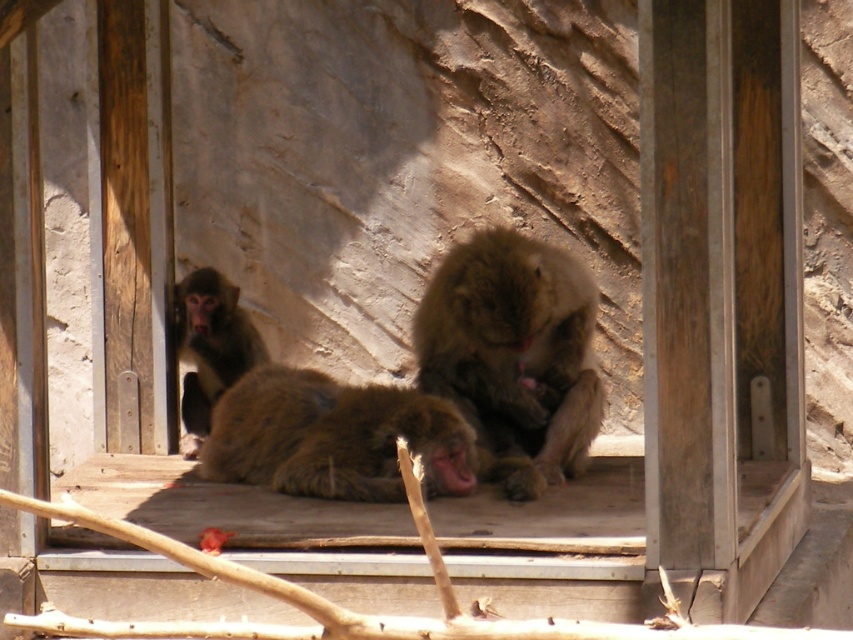
Does brown furry monkey at center have a lesser height compared to brown fur monkey at left?

No.

Between brown furry monkey at center and brown fur monkey at left, which one has less height?

brown fur monkey at left

Is point (534, 400) in front of point (210, 282)?

Yes, it is.

Where is `brown furry monkey at center`? Image resolution: width=853 pixels, height=640 pixels. brown furry monkey at center is located at coordinates (514, 355).

Is fuzzy brown monkey at center shorter than brown fur monkey at left?

Yes.

Find the location of `fuzzy brown monkey at center`. fuzzy brown monkey at center is located at coordinates (334, 436).

Where is `fuzzy brown monkey at center`? The image size is (853, 640). fuzzy brown monkey at center is located at coordinates (334, 436).

Who is lower down, brown furry monkey at center or fuzzy brown monkey at center?

fuzzy brown monkey at center is below.

Can you confirm if brown furry monkey at center is bigger than fuzzy brown monkey at center?

Yes, brown furry monkey at center is bigger than fuzzy brown monkey at center.

You are a GUI agent. You are given a task and a screenshot of the screen. Output one action in this format:
    pyautogui.click(x=<x>, y=<y>)
    Task: Click on the brown furry monkey at center
    The height and width of the screenshot is (640, 853).
    Given the screenshot: What is the action you would take?
    pyautogui.click(x=514, y=355)